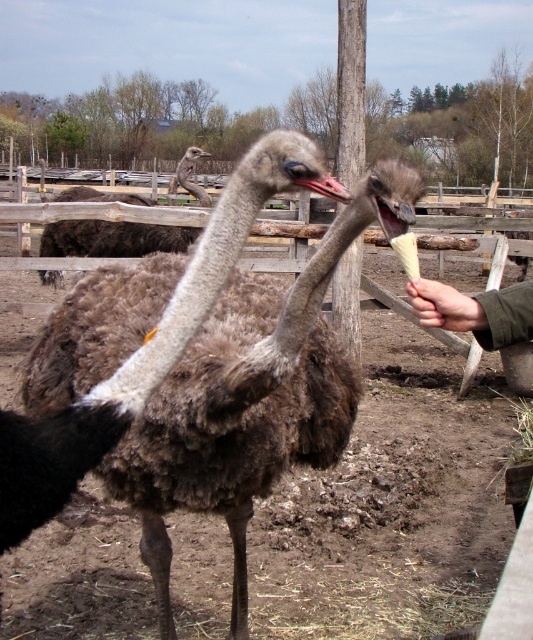
Question: Which point appears closest to the camera in this image?

Choices:
 (A) (482, 317)
 (B) (426, 300)

Answer: (A)

Question: Can you confirm if brown fuzzy ostrich at upper center is positioned to the left of green fabric hand at right?

Choices:
 (A) yes
 (B) no

Answer: (A)

Question: Which point is closer to the camera?

Choices:
 (A) brown fuzzy ostrich at center
 (B) smooth skin hand at center

Answer: (A)

Question: Does brown fuzzy ostrich at center have a lesser width compared to smooth skin hand at center?

Choices:
 (A) yes
 (B) no

Answer: (B)

Question: Can you confirm if brown fuzzy ostrich at center is positioned to the left of green fabric hand at right?

Choices:
 (A) no
 (B) yes

Answer: (B)

Question: Estimate the real-world distances between objects in this image. Which object is closer to the smooth skin hand at center?

Choices:
 (A) brown fuzzy ostrich at center
 (B) brown fuzzy ostrich at upper center
 (C) green fabric hand at right

Answer: (C)